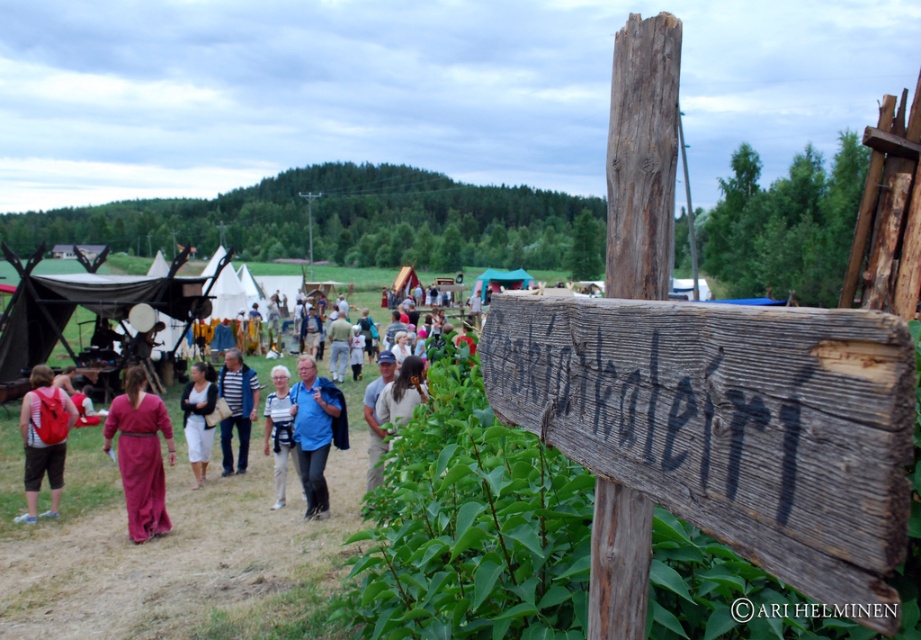
You are standing at the wooden signpost with the word Kaleiri. You see two points in the scene, point (120, 436) and point (372, 397). Which point is closer to you?

Point (120, 436) is in front of point (372, 397), so it is closer to you.

You are organizing a photo shoot and want to ensure that the matte pink dress at center and the light brown leather jacket at center can be clearly seen in the frame. Based on their sizes, which item might require more space in the composition?

The matte pink dress at center might require more space in the composition since it is wider than the light brown leather jacket at center according to the description.